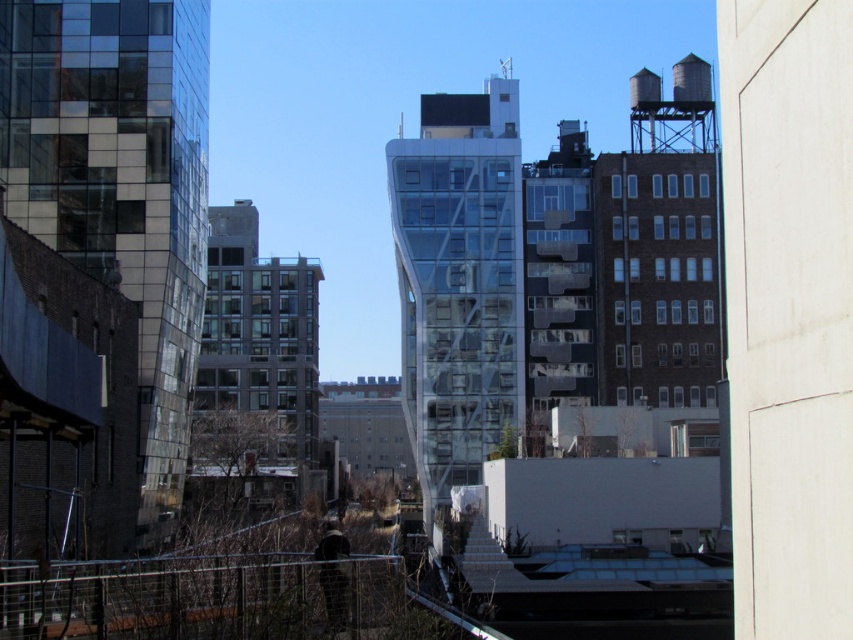
Question: Can you confirm if metallic water tower at center is wider than metallic wire fence at lower center?

Choices:
 (A) yes
 (B) no

Answer: (A)

Question: Among these points, which one is nearest to the camera?

Choices:
 (A) (392, 568)
 (B) (514, 113)

Answer: (A)

Question: Does metallic water tower at center come in front of metallic wire fence at lower center?

Choices:
 (A) yes
 (B) no

Answer: (B)

Question: Which of the following is the closest to the observer?

Choices:
 (A) metallic water tower at center
 (B) metallic wire fence at lower center

Answer: (B)

Question: Observing the image, what is the correct spatial positioning of metallic water tower at center in reference to metallic wire fence at lower center?

Choices:
 (A) below
 (B) above

Answer: (B)